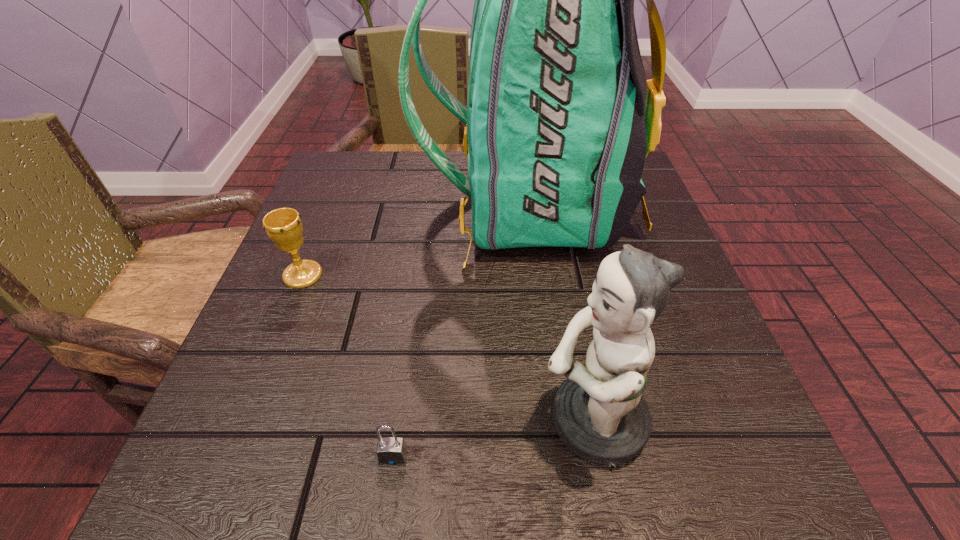
Identify the location of backpack. (560, 117).

Where is `the second tallest object`? The width and height of the screenshot is (960, 540). the second tallest object is located at coordinates (599, 412).

Find the location of a particular element. The height and width of the screenshot is (540, 960). the leftmost object is located at coordinates (284, 226).

Identify the location of chalice. (284, 226).

Where is `the shortest object`? the shortest object is located at coordinates (391, 450).

Identify the location of vacant space located 0.060m on the back of the tallest object. The width and height of the screenshot is (960, 540). (396, 208).

The image size is (960, 540). In order to click on free point located 0.180m on the back of the tallest object in this screenshot , I will do `click(339, 208)`.

Where is `free point located 0.250m on the back of the tallest object`? free point located 0.250m on the back of the tallest object is located at coordinates (306, 208).

Locate an element on the screen. vacant region located 0.240m on the front-facing side of the figurine is located at coordinates (361, 421).

At what (x,y) coordinates should I click in order to perform the action: click on free location located on the front-facing side of the figurine. Please return your answer as a coordinate pair (x, y). The height and width of the screenshot is (540, 960). Looking at the image, I should click on (420, 421).